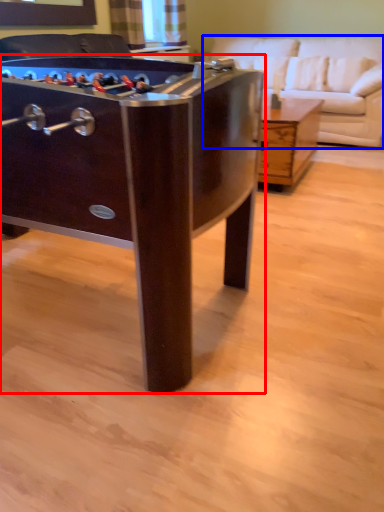
Question: Which of the following is the closest to the observer, table (highlighted by a red box) or studio couch (highlighted by a blue box)?

Choices:
 (A) table
 (B) studio couch

Answer: (A)